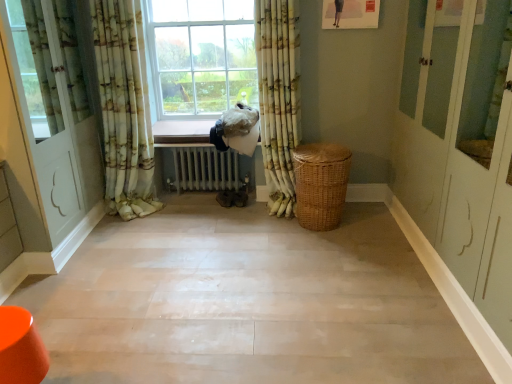
Identify the location of vacant region to the left of woven brown basket at center-right. (268, 236).